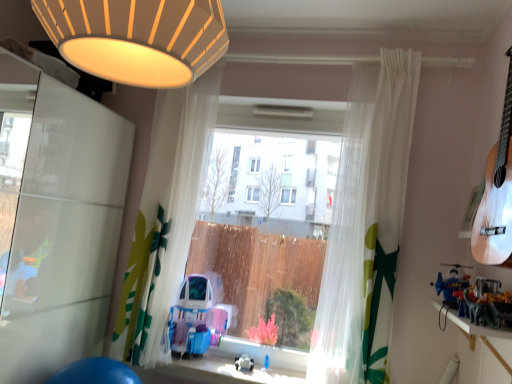
Question: From the image's perspective, relative to translucent fabric curtain at center, placed as the second curtain when sorted from left to right, is metallic silver dinosaur at right, placed as the third toy when sorted from bottom to top, above or below?

Choices:
 (A) below
 (B) above

Answer: (A)

Question: Visually, is metallic silver dinosaur at right, positioned as the first toy in top-to-bottom order, positioned to the left or to the right of translucent fabric curtain at center, marked as the 1th curtain in a right-to-left arrangement?

Choices:
 (A) left
 (B) right

Answer: (B)

Question: Which of these objects is positioned closest to the wooden shelf at lower right?

Choices:
 (A) white sheer curtain at center, positioned as the second curtain in right-to-left order
 (B) metallic silver dinosaur at right, positioned as the first toy in top-to-bottom order
 (C) transparent plastic window at center
 (D) translucent fabric curtain at center, marked as the 1th curtain in a right-to-left arrangement
 (E) blue plastic helicopter at right, the 2th toy in the front-to-back sequence

Answer: (B)

Question: Which of these objects is positioned closest to the transparent plastic window at center?

Choices:
 (A) metallic silver dinosaur at right, the second toy from the right
 (B) white glossy screen door at left
 (C) translucent fabric curtain at center, placed as the second curtain when sorted from left to right
 (D) white matte guitar at right
 (E) white plastic toy at center, marked as the 3th toy in a right-to-left arrangement

Answer: (C)